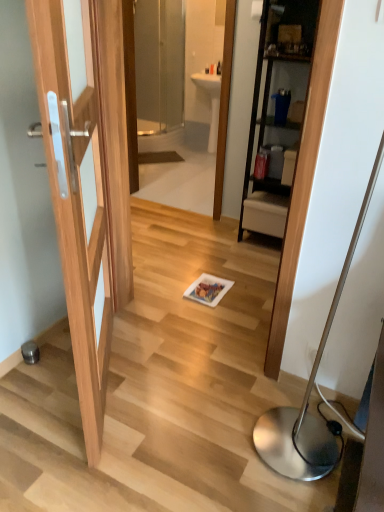
Identify the location of free space in front of transparent glass mirror at upper center. This screenshot has height=512, width=384. (172, 224).